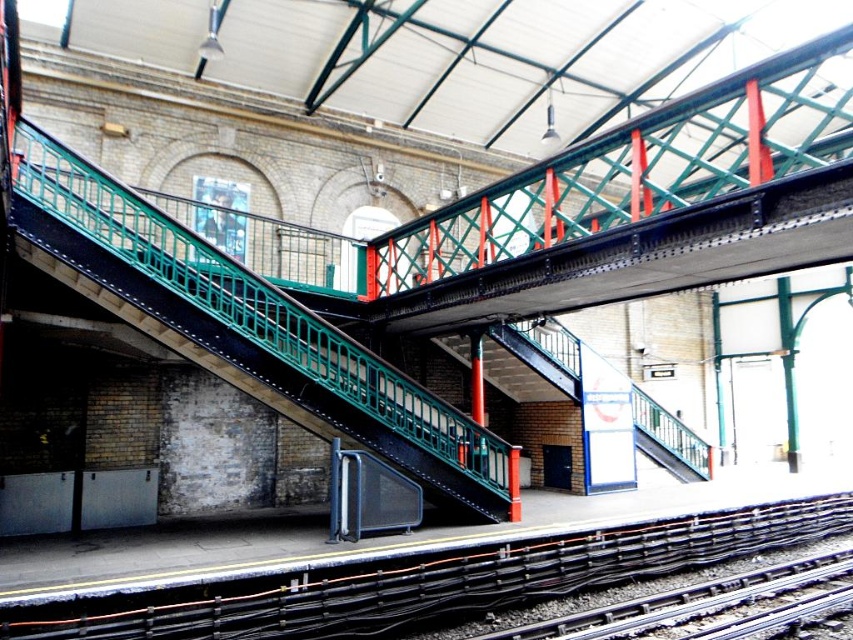
Question: Is black metal train track at lower left smaller than green metal staircase at center?

Choices:
 (A) no
 (B) yes

Answer: (A)

Question: Can you confirm if black metal train track at lower left is positioned below green metal staircase at center?

Choices:
 (A) yes
 (B) no

Answer: (A)

Question: Where is black metal train track at lower left located in relation to green metal staircase at center in the image?

Choices:
 (A) above
 (B) below

Answer: (B)

Question: Which of the following is the farthest from the observer?

Choices:
 (A) (573, 612)
 (B) (183, 316)
 (C) (321, 630)

Answer: (A)

Question: Considering the real-world distances, which object is closest to the green metal staircase at center?

Choices:
 (A) black metal train track at lower left
 (B) smooth steel tracks at bottom right

Answer: (A)

Question: Among these objects, which one is farthest from the camera?

Choices:
 (A) black metal train track at lower left
 (B) smooth steel tracks at bottom right

Answer: (B)